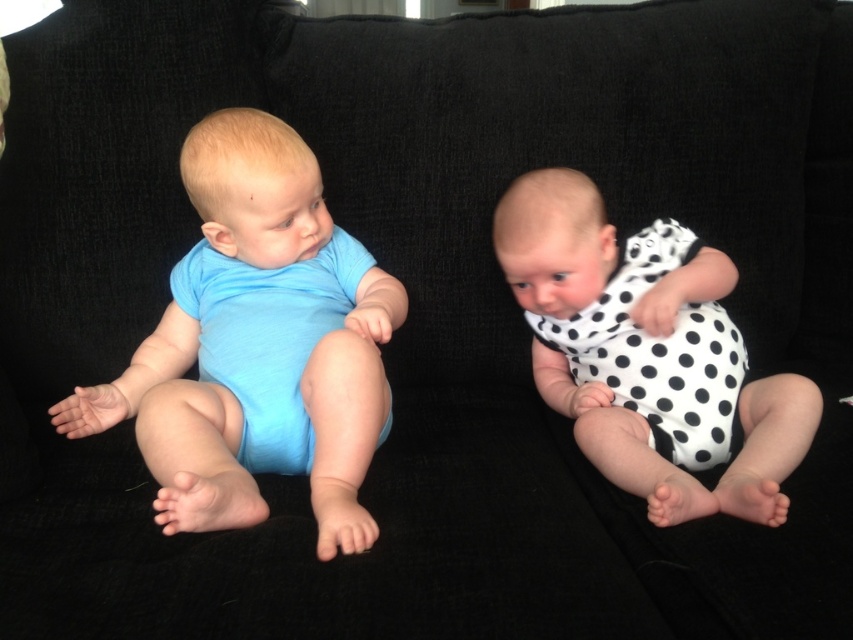
You are a photographer setting up a shoot with two babies on a couch. You need to position a toy between the two babies so it is equidistant from both. Given that the matte blue onesie at left is closer to you than the white dotted fabric at right, where should you place the toy relative to the babies?

Answer: Since the matte blue onesie at left is closer to the viewer than the white dotted fabric at right, you should place the toy closer to the white dotted fabric at right to ensure it is equidistant from both babies.

You are a photographer setting up a shoot with two babies on a couch. The babies are wearing a matte blue onesie at left and another outfit. You need to place a small prop exactly at the coordinates point (257, 346). Based on the scene description, which baby will the prop be placed near?

The prop will be placed near the baby wearing the matte blue onesie at left, as the coordinates point (257, 346) specifically indicate that location.

You are a photographer setting up a shoot with two babies on a couch. The babies are wearing the matte blue onesie at left and the white dotted fabric at right. Since you want to ensure the onesies are clearly visible in the photos, which baby should you position closer to the camera to account for their clothing size?

The matte blue onesie at left has a greater height compared to the white dotted fabric at right, so positioning the baby in the matte blue onesie at left closer to the camera will ensure their larger clothing is more visible in the photos.